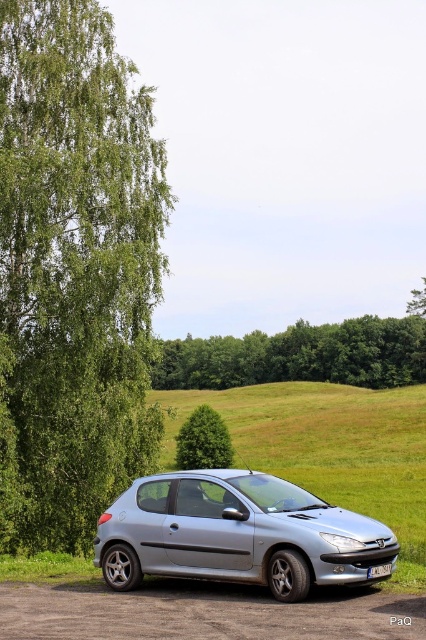
Question: Is green leafy tree at left wider than green leafy trees at center?

Choices:
 (A) no
 (B) yes

Answer: (A)

Question: Estimate the real-world distances between objects in this image. Which object is closer to the silver metallic car at center?

Choices:
 (A) green leafy tree at center
 (B) white plastic license plate at lower center
 (C) green leafy tree at left
 (D) green leafy trees at center

Answer: (B)

Question: Estimate the real-world distances between objects in this image. Which object is closer to the green leafy tree at center?

Choices:
 (A) green leafy tree at left
 (B) white plastic license plate at lower center

Answer: (A)

Question: Does silver metallic car at center have a larger size compared to white plastic license plate at lower center?

Choices:
 (A) no
 (B) yes

Answer: (B)

Question: Which of the following is the closest to the observer?

Choices:
 (A) green leafy tree at left
 (B) green leafy trees at center
 (C) silver metallic car at center

Answer: (C)

Question: Is green leafy tree at left wider than green leafy tree at center?

Choices:
 (A) yes
 (B) no

Answer: (B)